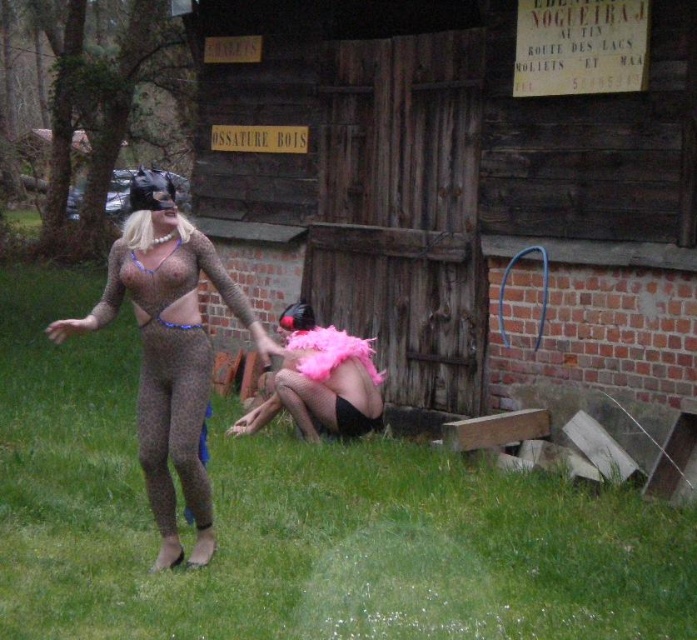
Question: Can you confirm if green grass at center is bigger than translucent purple bikini top at center?

Choices:
 (A) yes
 (B) no

Answer: (A)

Question: Does matte brown bodysuit at center have a greater width compared to pink feather boa at lower center?

Choices:
 (A) no
 (B) yes

Answer: (A)

Question: Which object is positioned farthest from the matte brown bodysuit at center?

Choices:
 (A) pink feather boa at lower center
 (B) green grass at center
 (C) matte brown bikini top at center

Answer: (A)

Question: Estimate the real-world distances between objects in this image. Which object is closer to the translucent purple bikini top at center?

Choices:
 (A) green grass at center
 (B) matte brown bikini top at center

Answer: (B)

Question: Among these points, which one is farthest from the camera?

Choices:
 (A) (153, 484)
 (B) (167, 323)
 (C) (298, 426)

Answer: (C)

Question: From the image, what is the correct spatial relationship of pink feather boa at lower center in relation to translucent purple bikini top at center?

Choices:
 (A) right
 (B) left

Answer: (A)